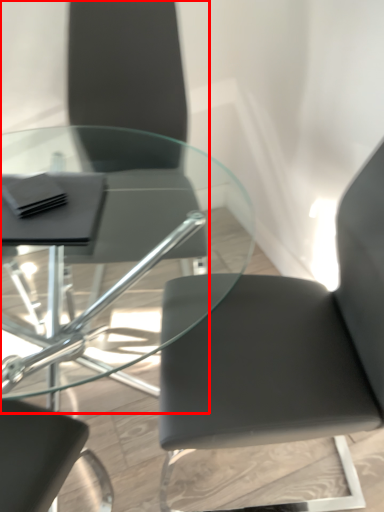
Question: Considering the relative positions of chair (annotated by the red box) and chair in the image provided, where is chair (annotated by the red box) located with respect to the staircase?

Choices:
 (A) left
 (B) right

Answer: (A)